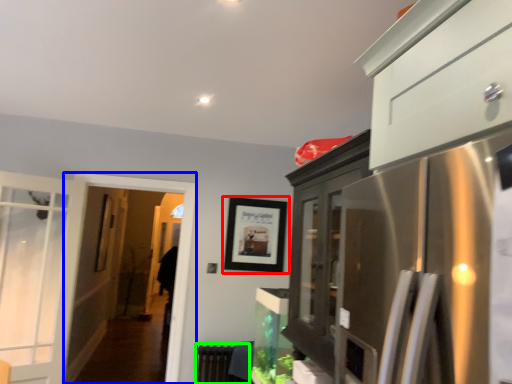
Question: Which is farther away from picture frame (highlighted by a red box)? screen door (highlighted by a blue box) or radiator (highlighted by a green box)?

Choices:
 (A) screen door
 (B) radiator

Answer: (B)